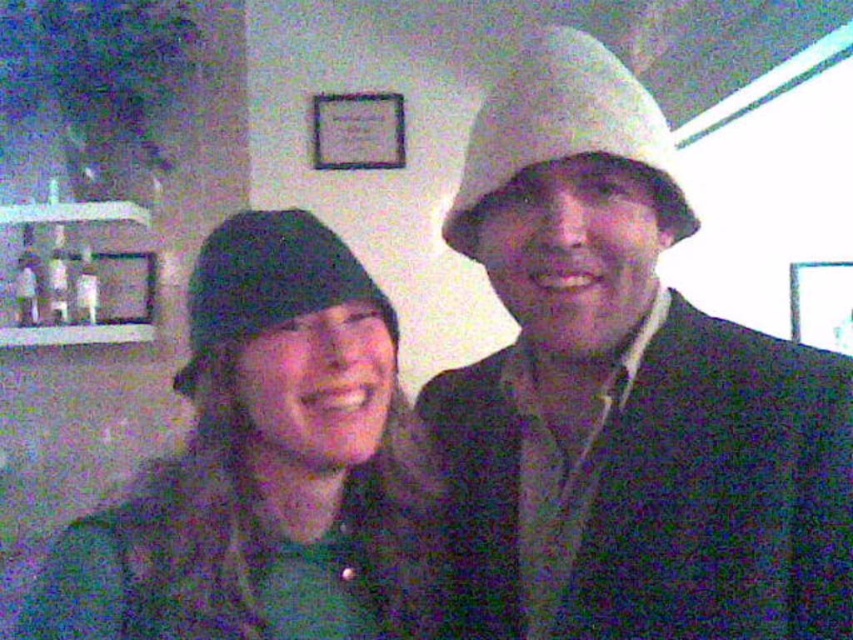
You are a photographer setting up a shoot in this room. You need to position a light source to highlight both the black knit beanie at left and the white matte hat at upper right. Based on their positions, where should you place the light source to ensure both are well lit without creating harsh shadows?

The black knit beanie at left is located below the white matte hat at upper right. To light both effectively, position the light source above and slightly to the side of the white matte hat at upper right, casting light downward toward the black knit beanie at left. This setup will illuminate both objects while minimizing harsh shadows.

You are a photographer trying to capture a clear shot of both the black knit beanie at left and the black knit hat at left. Since both are on the left side, which one might be partially hidden in the photo?

The black knit beanie at left is in front of the black knit hat at left, so the black knit hat at left might be partially hidden behind the beanie.

You are a photographer standing 30 inches away from the black knit beanie at left. Can you capture a clear closeup shot of it without moving closer?

The black knit beanie at left is only 26.92 inches away from the camera, which is closer than your current position of 30 inches. To capture a clear closeup, you need to move 3.08 inches closer to the black knit beanie at left.